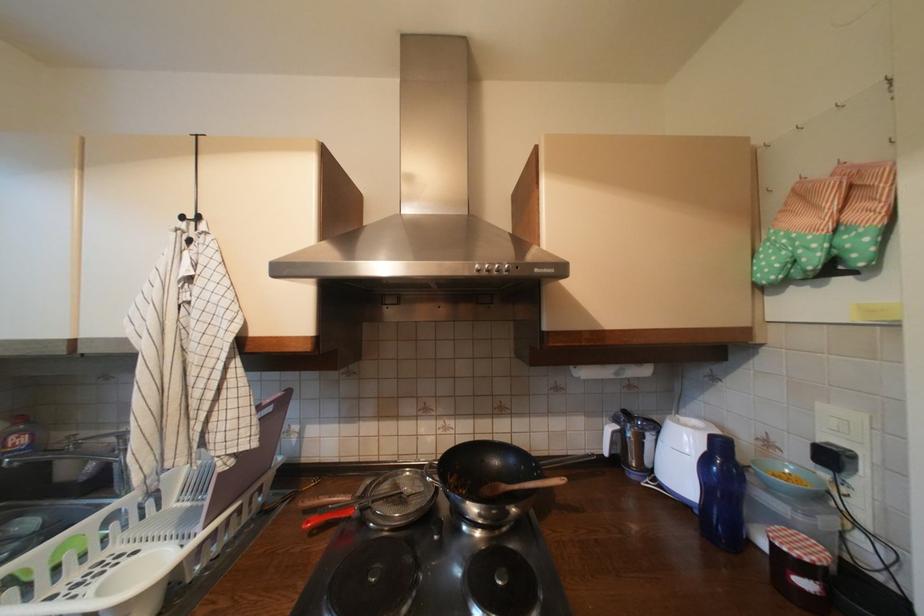
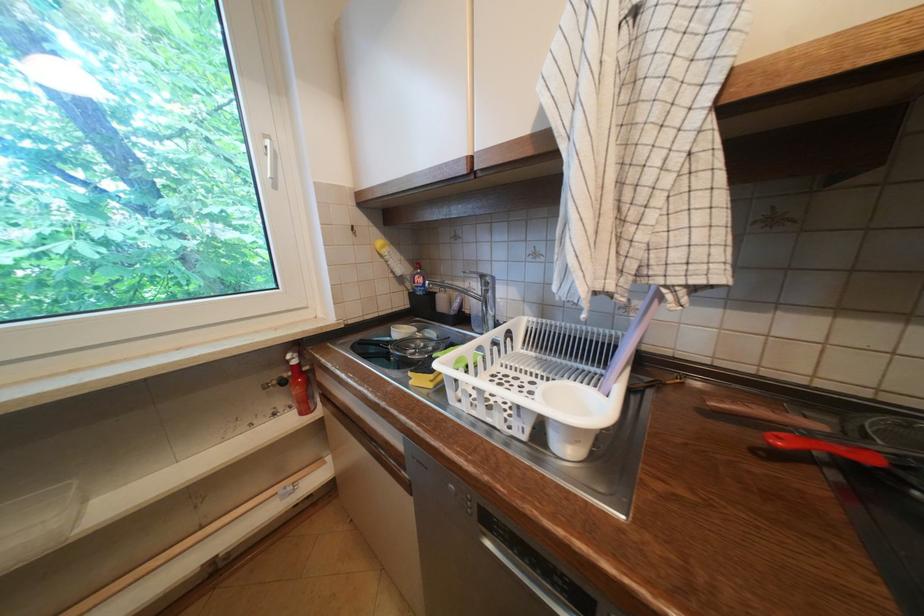
How did the camera likely rotate?

The camera rotated toward left-down.